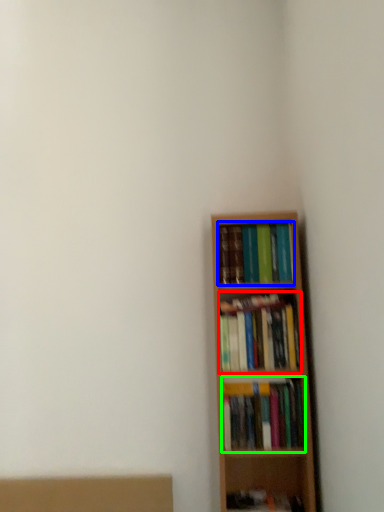
Question: Estimate the real-world distances between objects in this image. Which object is closer to book (highlighted by a red box), book (highlighted by a blue box) or book (highlighted by a green box)?

Choices:
 (A) book
 (B) book

Answer: (B)